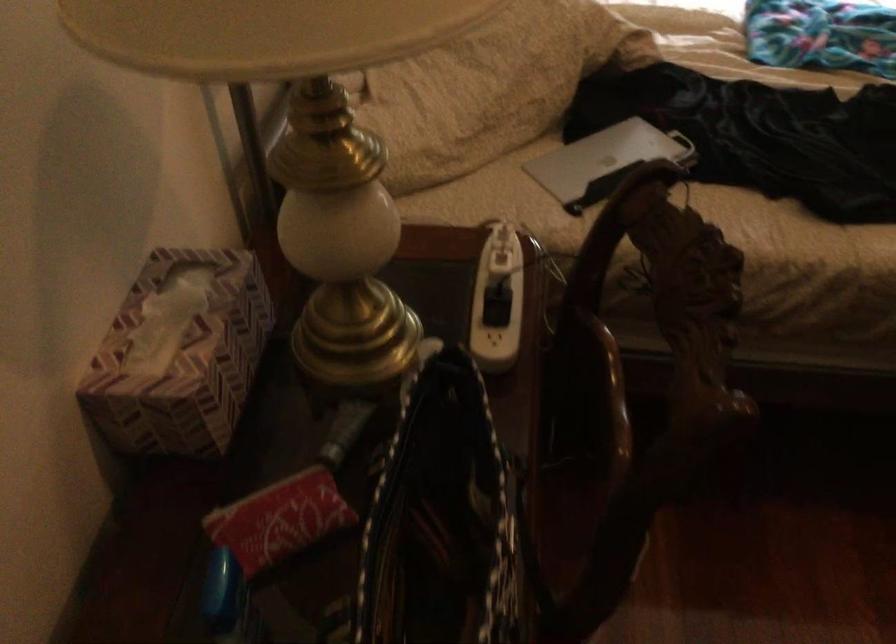
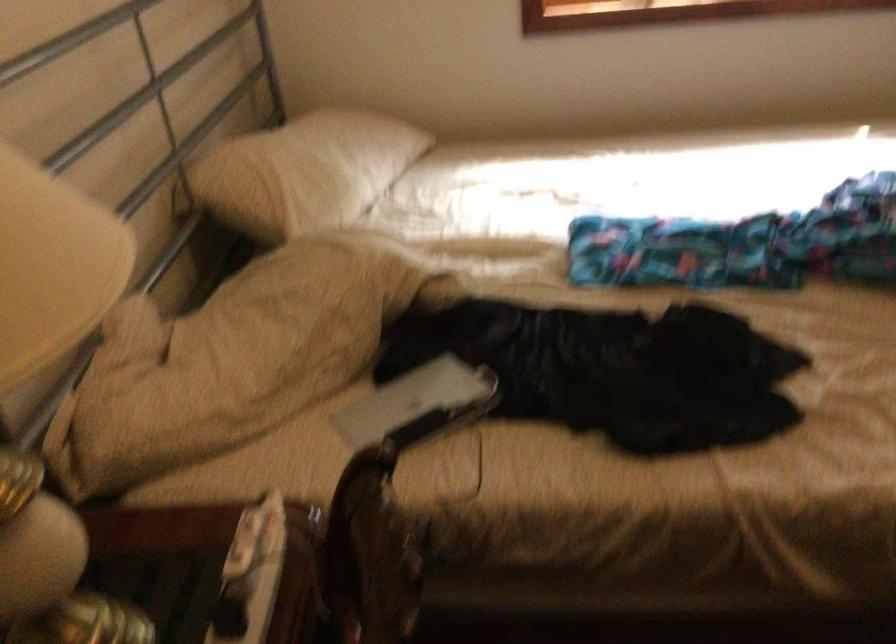
The point at [615,156] is marked in the first image. Where is the corresponding point in the second image?

(418, 404)